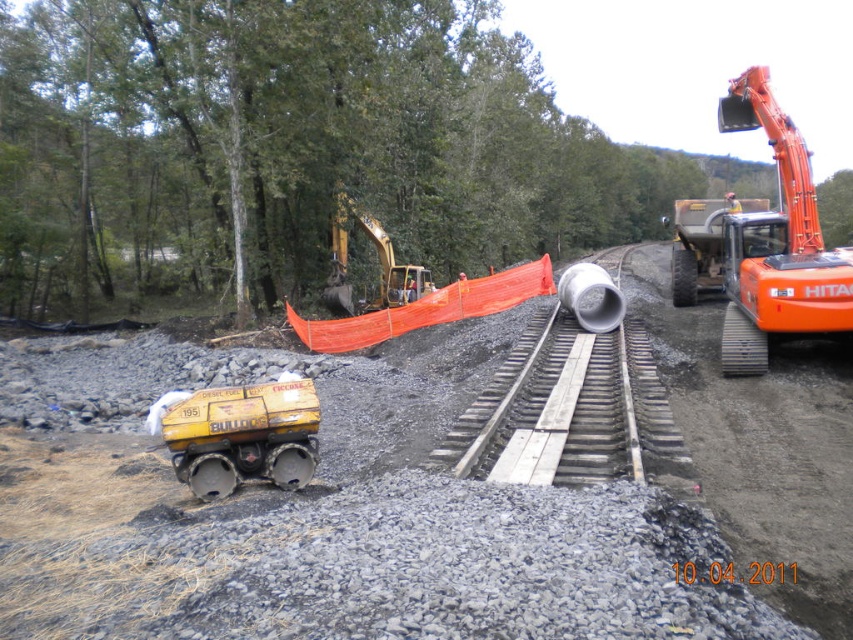
You are a construction worker standing at the center of the image. You need to place a new rail segment between the two points labeled as point (196, 413) and point (379, 296). Which point should you start placing the rail segment first, the one closer to you or the one farther away?

You should start placing the rail segment at point (196, 413) first because it is closer to you than point (379, 296), so you can work towards the farther point.

You are standing at the camera position and want to reach point (846,481). Is the distance more than 20 feet?

Yes, the distance between the camera and point (846,481) is 24.57 feet, which is more than 20 feet.

You are a worker standing at the edge of the construction site. You need to move a heavy load from the matte yellow bulldozer at lower left to the orange metallic excavator at right. Which direction should you move the load to ensure it reaches the excavator?

The matte yellow bulldozer at lower left is positioned under the orange metallic excavator at right, so you should move the load upward to reach the excavator.